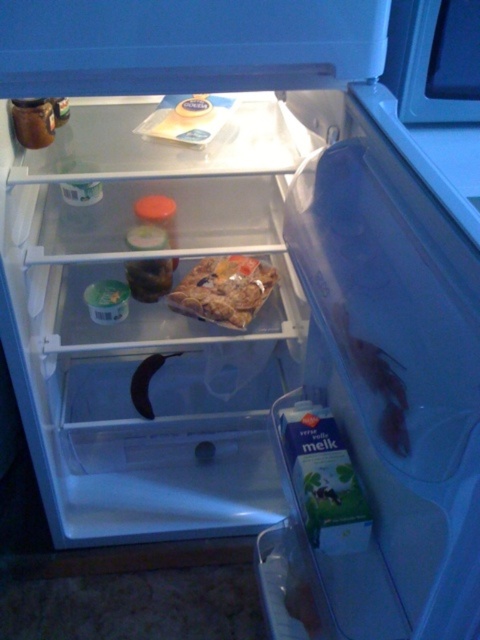
You are organizing the fridge and need to move the translucent plastic bag of cookies at center and the translucent plastic milk carton at lower right. Which item is closer to the fridge door?

The translucent plastic bag of cookies at center is closer to the fridge door because it is to the left of the translucent plastic milk carton at lower right, and in the fridge layout, items on the left are typically closer to the door.

You are organizing the contents of the refrigerator and need to place a new item that requires more space than the existing items. Which item between the translucent plastic bag of cookies at center and the translucent plastic milk carton at lower right should you consider replacing to free up more space?

The translucent plastic bag of cookies at center is larger in size than the translucent plastic milk carton at lower right, so replacing the bag of cookies would free up more space.